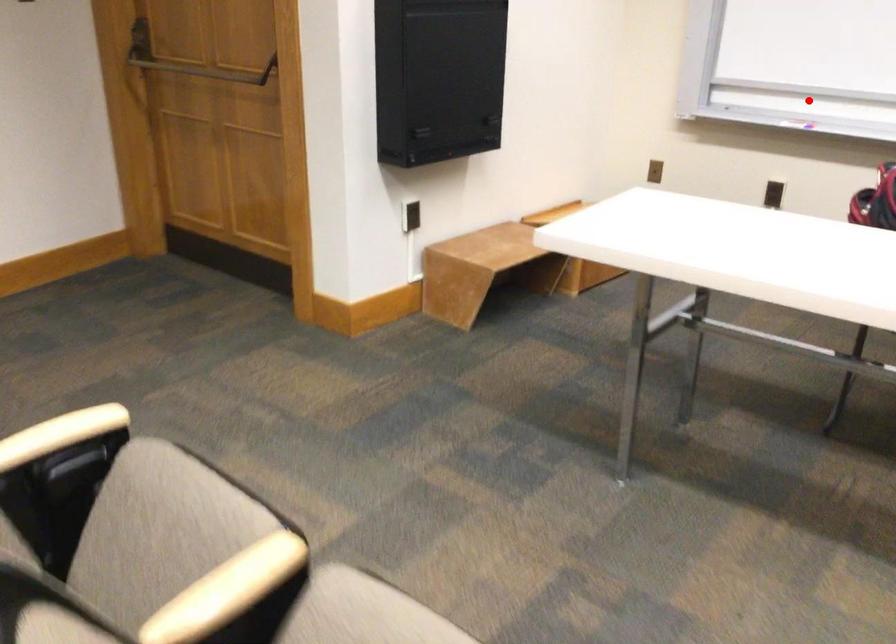
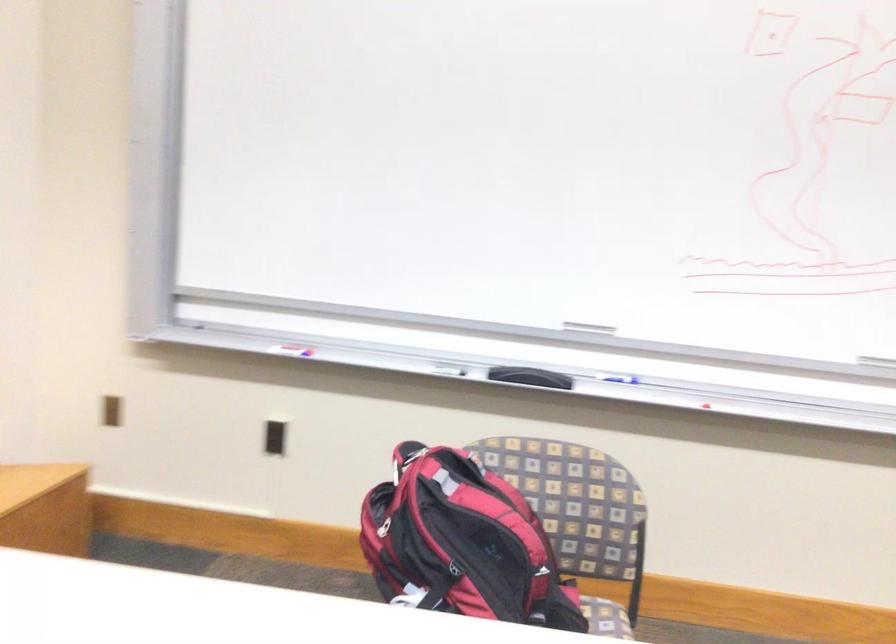
Question: A red point is marked in image1. In image2, is the corresponding 3D point closer to the camera or farther? Reply with the corresponding letter.

Choices:
 (A) The corresponding 3D point is closer.
 (B) The corresponding 3D point is farther.

Answer: (A)